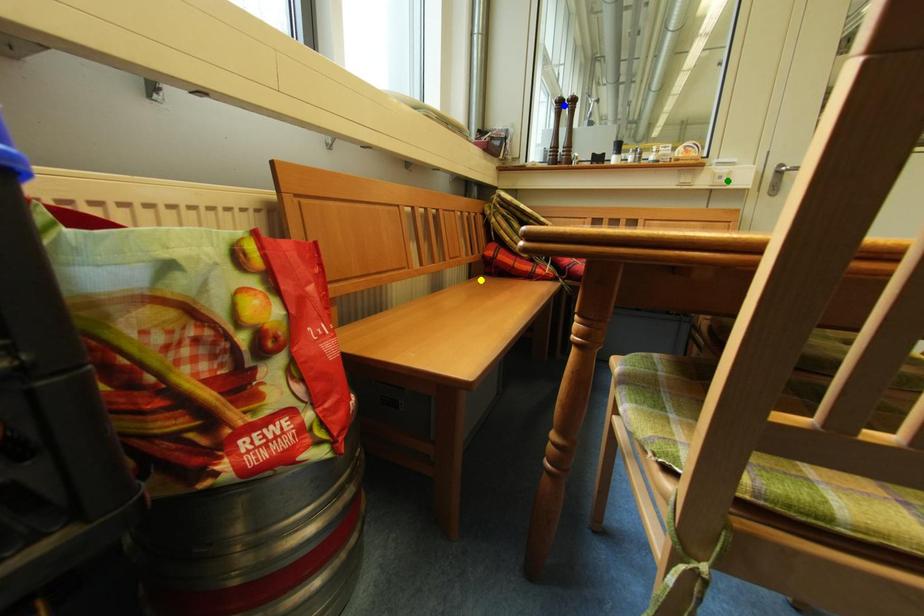
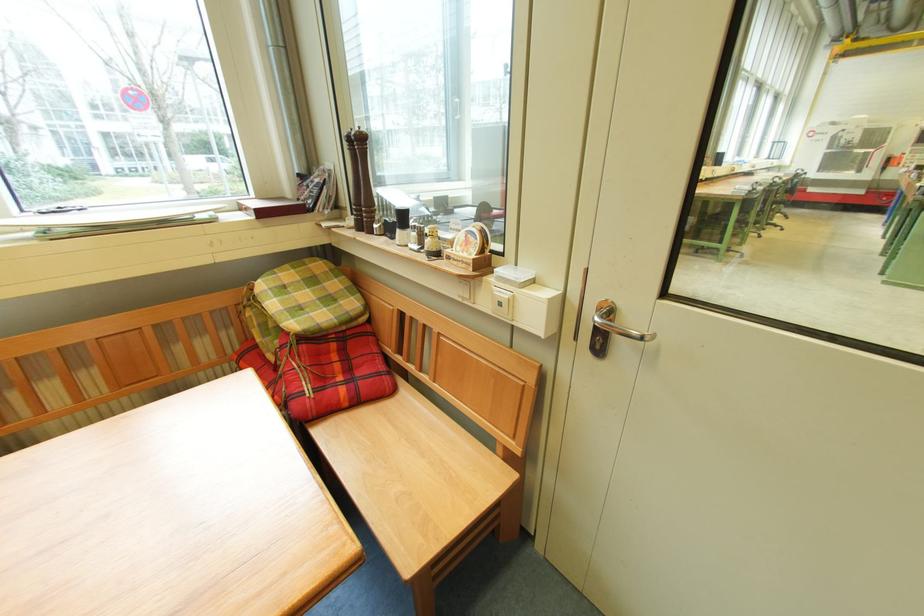
I am providing you with two images of the same scene from different viewpoints. Three points are marked in image1. Which point corresponds to a part or object that is occluded in image2?In image1, three points are marked. Which of them correspond to a part or object that is occluded in image2?Among the three points shown in image1, which one corresponds to a part or object that is no longer visible due to occlusion in image2?

yellow point